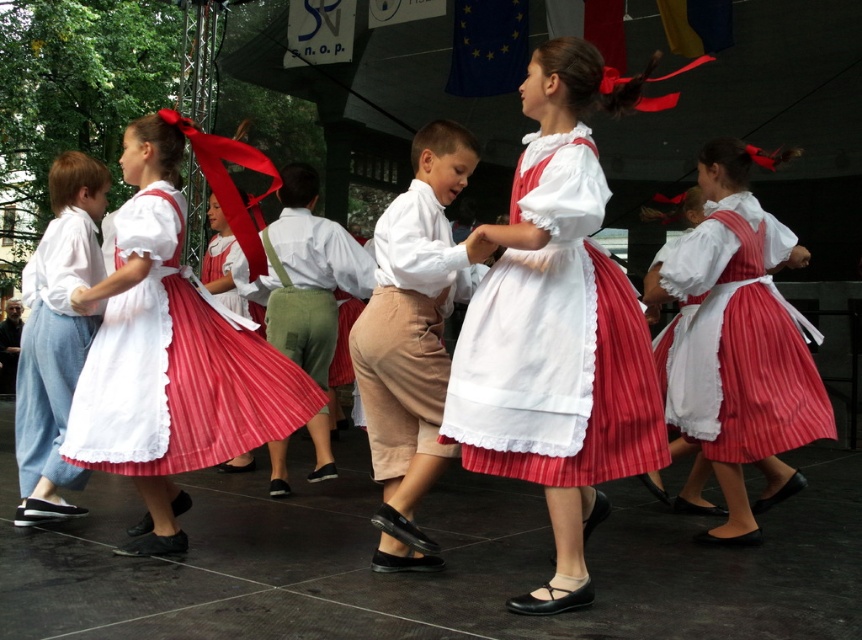
Question: Which point is closer to the camera?

Choices:
 (A) matte white dress at left
 (B) white pleated dress at center

Answer: (B)

Question: Does matte red skirt at right appear under tan cotton skirt at center?

Choices:
 (A) no
 (B) yes

Answer: (A)

Question: Which object is positioned closest to the white pleated dress at center?

Choices:
 (A) matte white dress at left
 (B) tan cotton skirt at center
 (C) matte white skirt at left

Answer: (B)

Question: Does white pleated dress at center have a lesser width compared to matte red skirt at right?

Choices:
 (A) yes
 (B) no

Answer: (B)

Question: Does matte white dress at left have a smaller size compared to tan cotton skirt at center?

Choices:
 (A) yes
 (B) no

Answer: (B)

Question: Which of these objects is positioned farthest from the matte white skirt at left?

Choices:
 (A) tan cotton skirt at center
 (B) white pleated dress at center

Answer: (B)